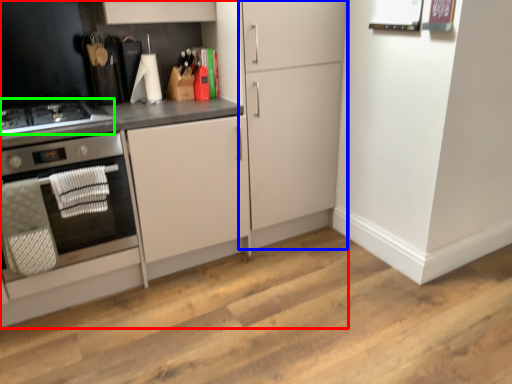
Question: Based on their relative distances, which object is farther from cabinetry (highlighted by a red box)? Choose from cabinetry (highlighted by a blue box) and gas stove (highlighted by a green box).

Choices:
 (A) cabinetry
 (B) gas stove

Answer: (B)